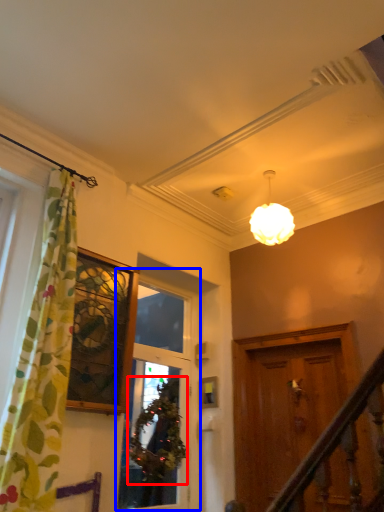
Question: Which of the following is the closest to the observer, plant (highlighted by a red box) or window (highlighted by a blue box)?

Choices:
 (A) plant
 (B) window

Answer: (B)